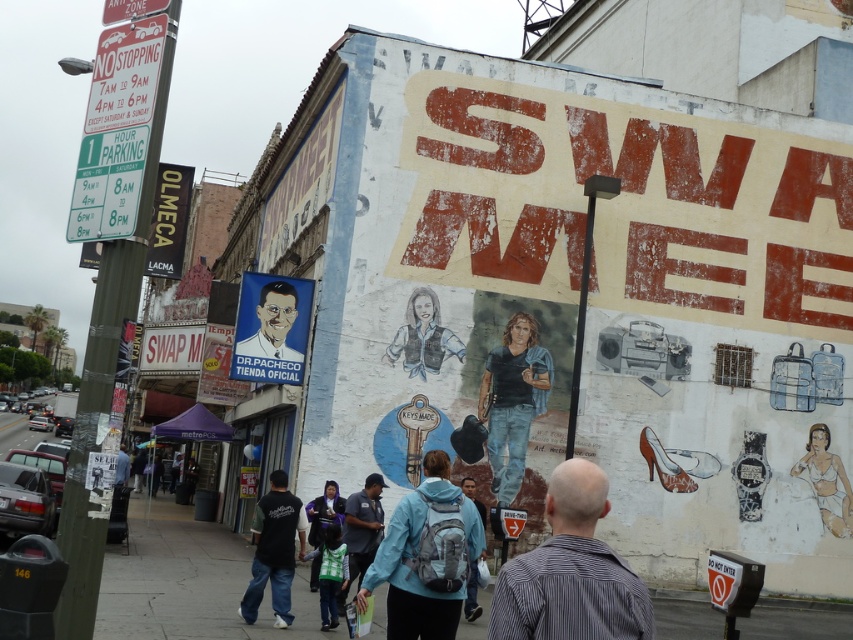
You are a street artist who wants to hang a new poster between the blue jeans at center and the matte blue poster at center. Which object is shorter so that your new poster can be placed above it?

The blue jeans at center is not as tall as matte blue poster at center, so you should place the new poster above the blue jeans at center.

You are standing on the sidewalk and want to walk towards the wall with the graffiti. Which point, point (x=427, y=595) or point (x=310, y=531), will you reach first?

Point (x=427, y=595) is closer to the viewer than point (x=310, y=531), so you will reach point (x=427, y=595) first.